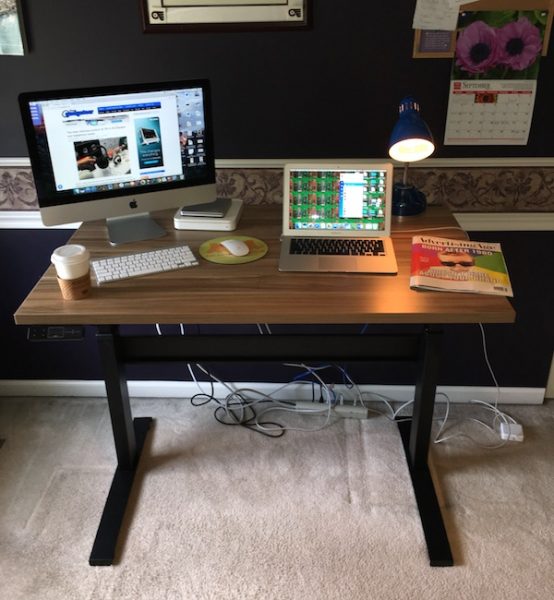
I want to click on lamp, so click(411, 147).